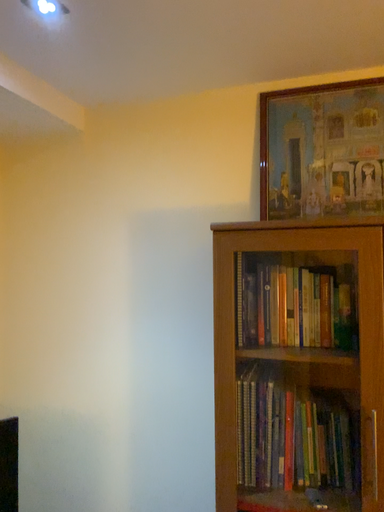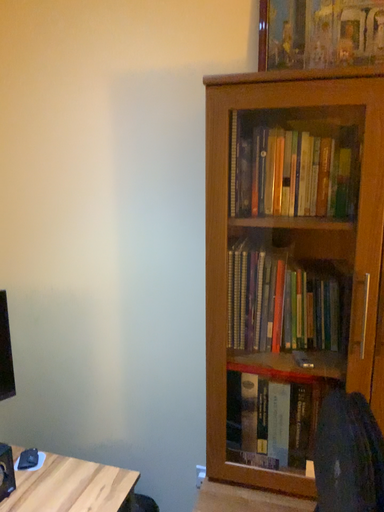
Question: How did the camera likely rotate when shooting the video?

Choices:
 (A) rotated upward
 (B) rotated downward

Answer: (B)